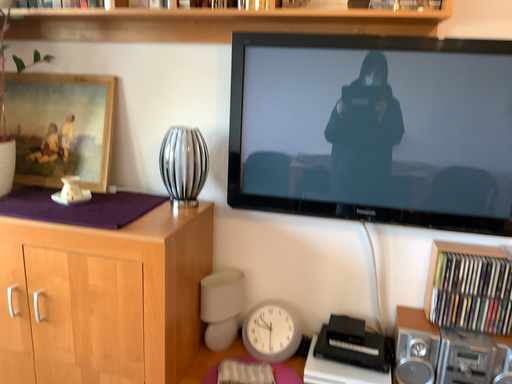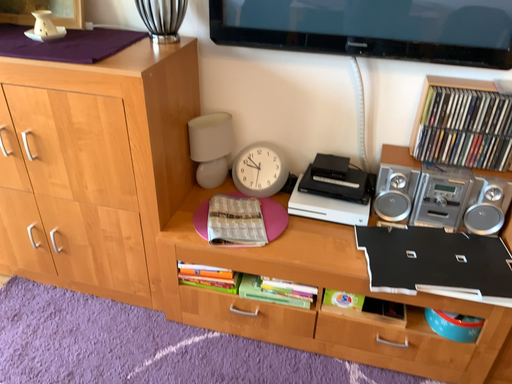
Question: Which way did the camera rotate in the video?

Choices:
 (A) rotated downward
 (B) rotated upward

Answer: (A)